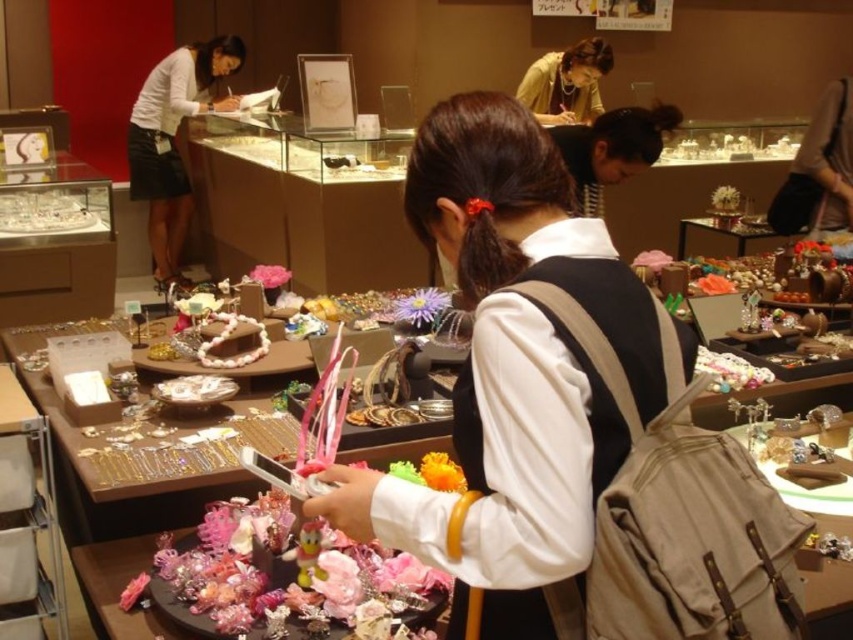
You are a store employee who needs to retrieve a customer service form from the counter. The form is located between the white matte backpack at center and the matte yellow blouse at upper center. Since the counter is 3 meters long, can you fit both items on the counter while retrieving the form?

The white matte backpack at center and the matte yellow blouse at upper center are 4.53 meters apart from each other. Since the counter is only 3 meters long, they cannot both fit on the counter at the same time.

You are standing at point (x=585, y=122) and want to reach point (x=184, y=198). Is the path between these points clear of any obstacles?

Yes, the path between point (x=184, y=198) and point (x=585, y=122) is clear since point (x=184, y=198) is in front of point (x=585, y=122), indicating no obstacles block the way.

You are a customer in the jewelry store and want to place a small necklace on the table between the white matte backpack at center and the white matte skirt at upper left. Which object should you place it closer to if you want it near the shorter item?

The white matte backpack at center is shorter than the white matte skirt at upper left, so you should place the necklace closer to the white matte backpack at center.